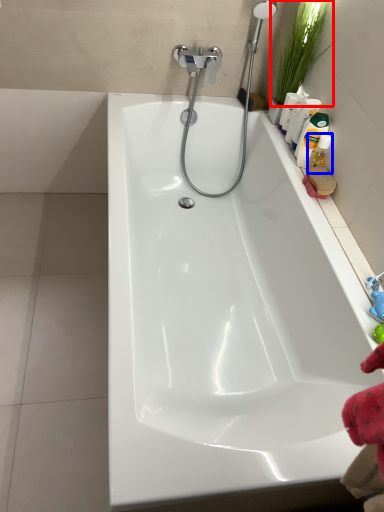
Question: Which of the following is the farthest to the observer, plant (highlighted by a red box) or cleaning product (highlighted by a blue box)?

Choices:
 (A) plant
 (B) cleaning product

Answer: (B)